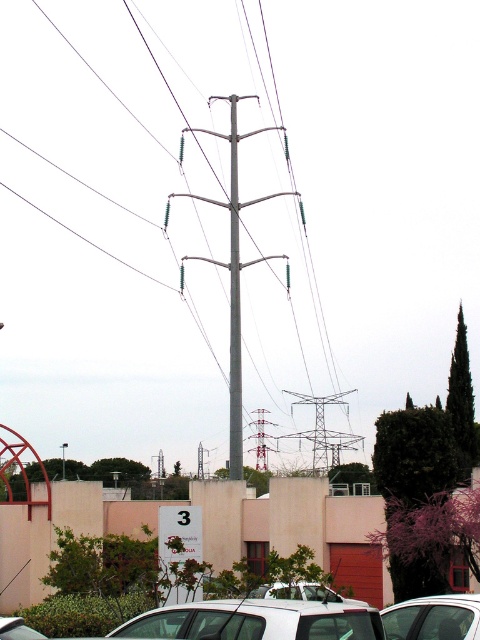
Question: Does metallic amusement park ride at center have a smaller size compared to metallic gray telegraph pole at center?

Choices:
 (A) yes
 (B) no

Answer: (A)

Question: Can you confirm if white matte car at lower center is bigger than metallic gray telegraph pole at center?

Choices:
 (A) no
 (B) yes

Answer: (A)

Question: Which is farther from the white glossy car at center?

Choices:
 (A) metallic amusement park ride at center
 (B) white glossy car at lower right

Answer: (A)

Question: Which of the following is the closest to the observer?

Choices:
 (A) metallic amusement park ride at center
 (B) white glossy car at center
 (C) metallic gray telegraph pole at center

Answer: (A)

Question: Which point is farther to the camera?

Choices:
 (A) white glossy car at lower right
 (B) metallic gray telegraph pole at center

Answer: (B)

Question: Is metallic gray telegraph pole at center behind white glossy car at center?

Choices:
 (A) yes
 (B) no

Answer: (A)